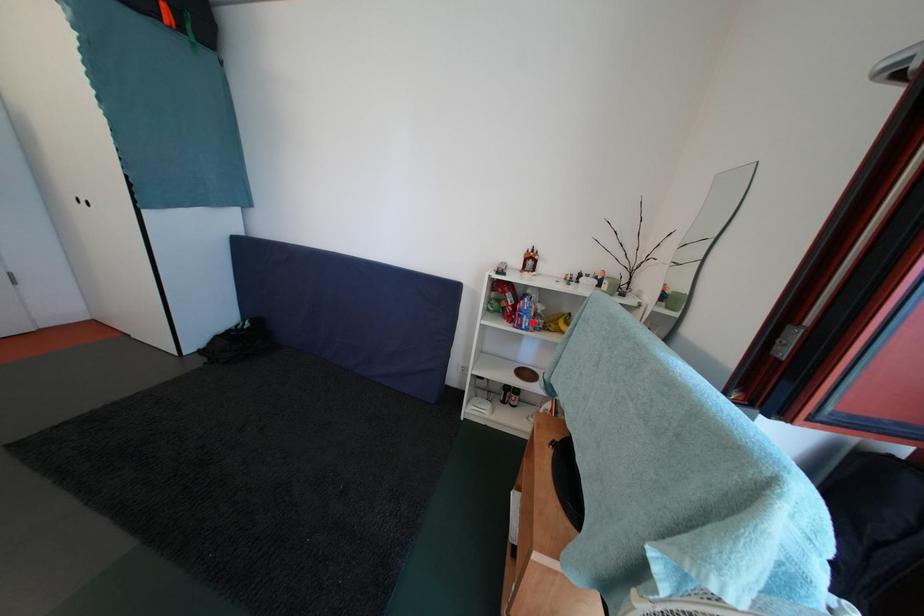
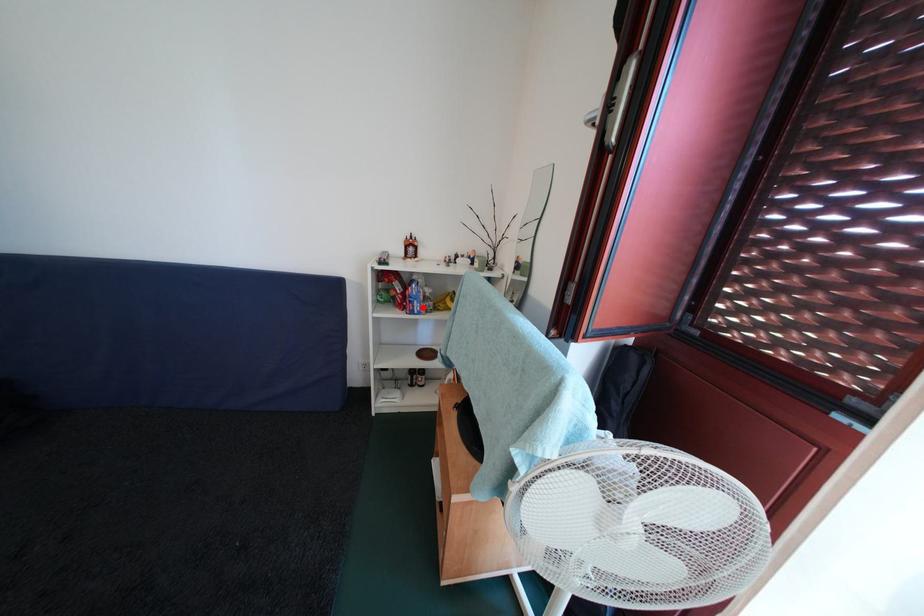
I am providing you with two images of the same scene from different viewpoints. A red point is marked on the first image and another point is marked on the second image. Are the points marked in image1 and image2 representing the same 3D position?

Yes